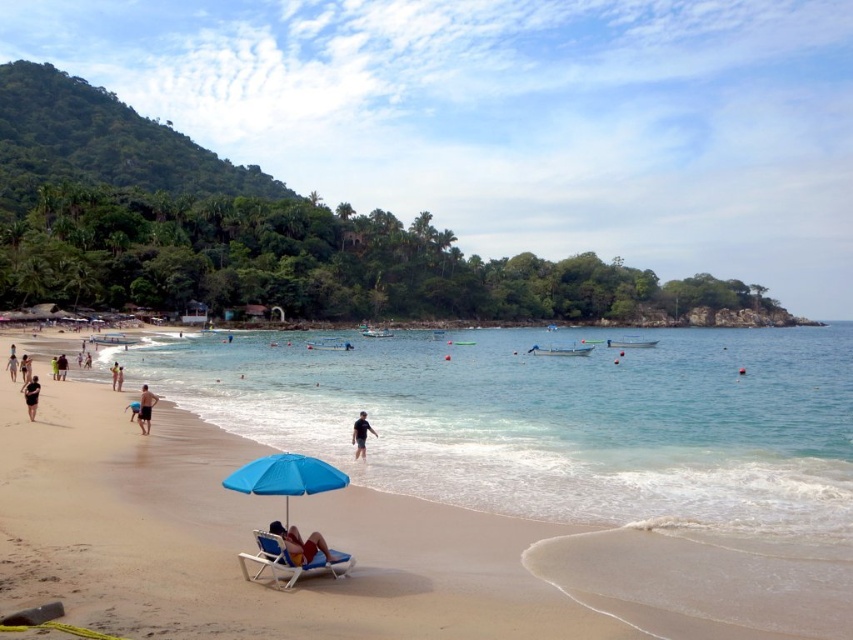
Is black fabric person at lower left to the right of tan skin person at lower left from the viewer's perspective?

Yes, black fabric person at lower left is to the right of tan skin person at lower left.

Who is shorter, black fabric person at lower left or tan skin person at lower left?

black fabric person at lower left is shorter.

Is point (28, 413) closer to viewer compared to point (9, 355)?

Yes, it is in front of point (9, 355).

Where is `black fabric person at lower left`? Image resolution: width=853 pixels, height=640 pixels. black fabric person at lower left is located at coordinates (32, 396).

Who is higher up, matte blue umbrella at center or black fabric shorts at lower left?

black fabric shorts at lower left is above.

From the picture: Who is more distant from viewer, (x=321, y=545) or (x=140, y=428)?

The point (x=140, y=428) is behind.

Is point (300, 560) in front of point (149, 417)?

Yes, it is in front of point (149, 417).

Locate an element on the screen. Image resolution: width=853 pixels, height=640 pixels. matte blue umbrella at center is located at coordinates (300, 544).

Consider the image. Who is higher up, black matte person at center or black fabric person at lower left?

Positioned higher is black fabric person at lower left.

Does point (358, 433) come in front of point (26, 385)?

That is True.

Does point (367, 428) come closer to viewer compared to point (32, 412)?

Yes, it is.

Identify the location of black matte person at center. This screenshot has height=640, width=853. (360, 435).